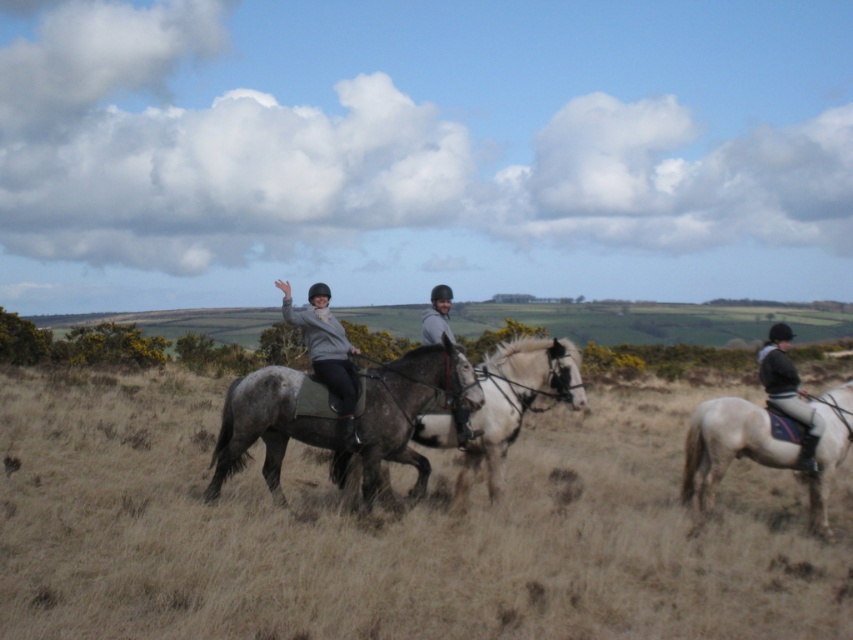
Based on the photo, you are a photographer standing at the edge of the field. You want to capture a photo of the matte gray jacket at center without the dry grass at center appearing in the background. Given that your camera has a depth of field of 3 meters, can you achieve this?

The distance between the dry grass at center and matte gray jacket at center is 4.63 meters. Since the depth of field is only 3 meters, the dry grass at center will still be in focus along with the matte gray jacket at center, making it impossible to exclude the dry grass at center from the background.

You are a photographer planning to capture a group photo of the riders and their horses. You need to ensure that the white glossy horse at center and the matte gray jacket at center are both clearly visible in the frame. Given their sizes, which object should you focus on to ensure both are in focus?

The white glossy horse at center is bigger than the matte gray jacket at center, so focusing on the white glossy horse at center will ensure both are in focus since it is larger and likely farther away, requiring a wider depth of field.

You are a photographer trying to capture a photo of the gray matte horse at center and the white glossy horse at right. Which horse should you focus on first if you want to include both in your frame without moving the camera?

The gray matte horse at center is positioned on the left side of the white glossy horse at right, so you should focus on the gray matte horse at center first to ensure both are in frame without moving the camera.